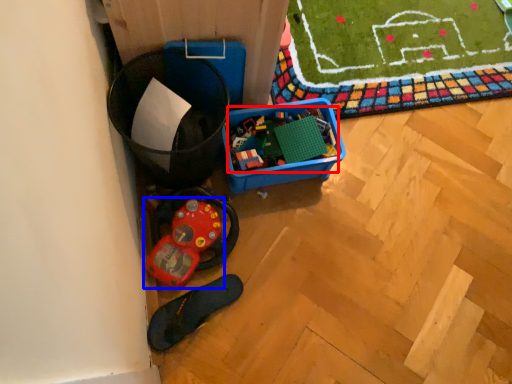
Question: Which object appears closest to the camera in this image, toy (highlighted by a red box) or toy (highlighted by a blue box)?

Choices:
 (A) toy
 (B) toy

Answer: (B)